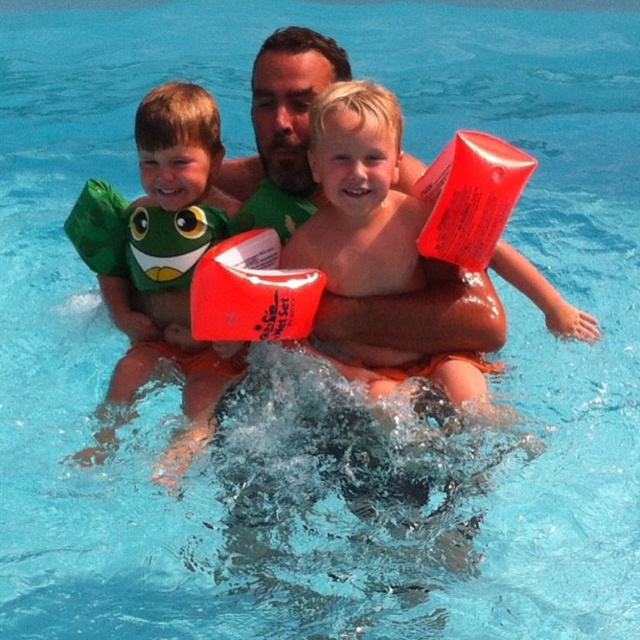
Question: Considering the relative positions of green rubber arm band at left and matte green swimsuit at center in the image provided, where is green rubber arm band at left located with respect to matte green swimsuit at center?

Choices:
 (A) left
 (B) right

Answer: (A)

Question: Which of the following is the farthest from the observer?

Choices:
 (A) (195, 442)
 (B) (284, 138)

Answer: (B)

Question: Does green rubber arm band at left have a lesser width compared to matte green swimsuit at center?

Choices:
 (A) yes
 (B) no

Answer: (B)

Question: Which object appears closest to the camera in this image?

Choices:
 (A) matte green swimsuit at center
 (B) green rubber arm band at left

Answer: (B)

Question: Which object appears closest to the camera in this image?

Choices:
 (A) matte green swimsuit at center
 (B) green rubber arm band at left

Answer: (B)

Question: Can you confirm if green rubber arm band at left is positioned to the right of matte green swimsuit at center?

Choices:
 (A) yes
 (B) no

Answer: (B)